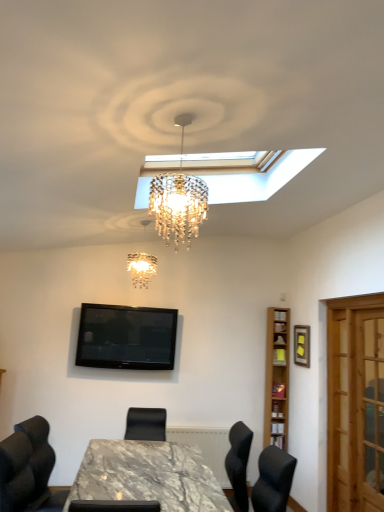
This screenshot has height=512, width=384. Find the location of `free point above marble table at center (from a real-world perspective)`. free point above marble table at center (from a real-world perspective) is located at coordinates (133, 468).